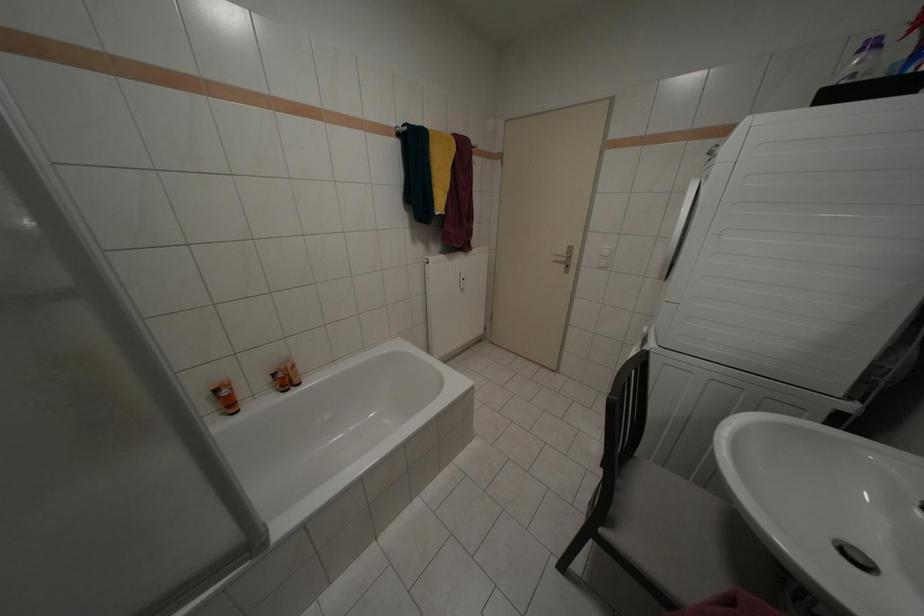
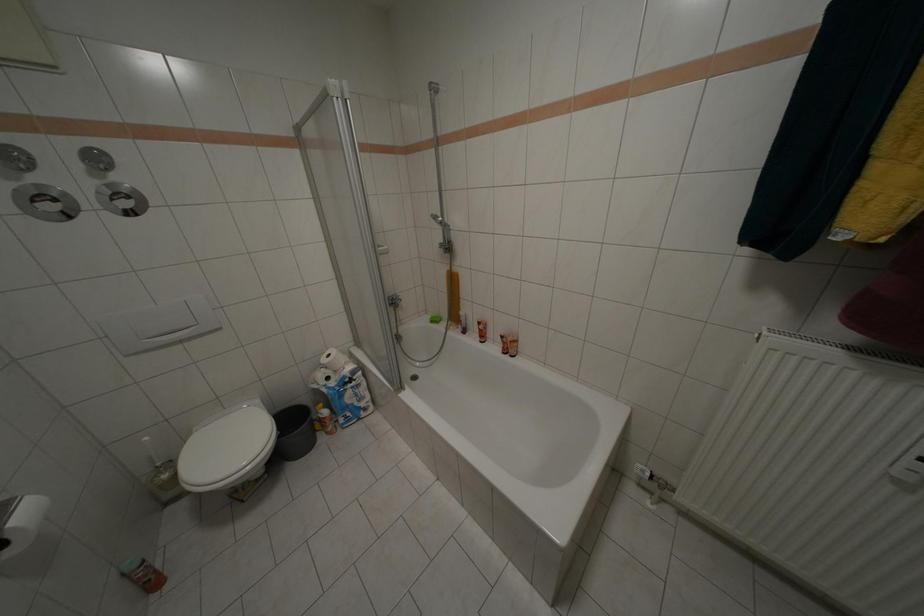
How did the camera likely rotate?

The camera's rotation is toward left-down.